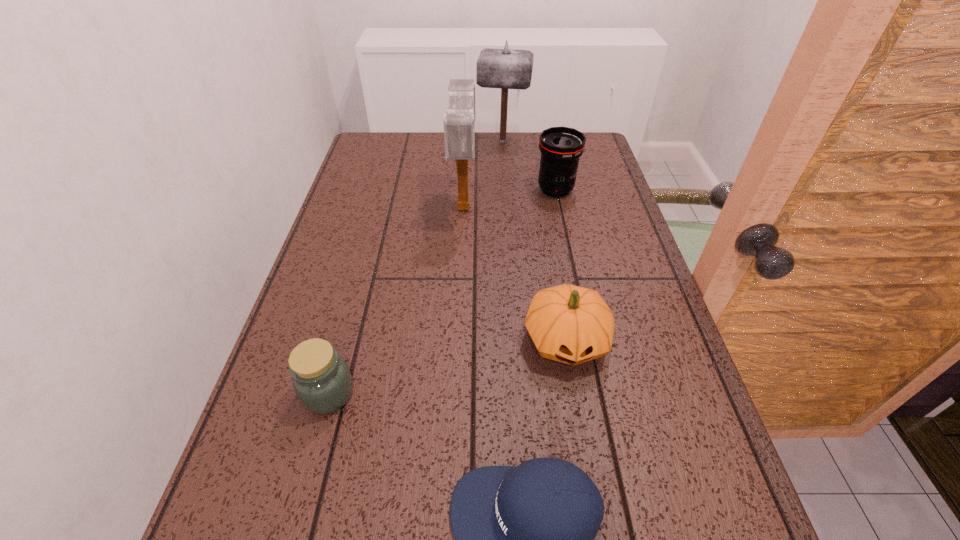
Locate an element on the screen. The image size is (960, 540). vacant space situated on the side of the third shortest object with the carved face is located at coordinates (587, 464).

Where is `vacant region located on the back of the leftmost object`? The width and height of the screenshot is (960, 540). vacant region located on the back of the leftmost object is located at coordinates (354, 298).

The height and width of the screenshot is (540, 960). I want to click on object that is at the far edge, so click(506, 68).

Identify the location of object that is positioned at the left edge. (322, 381).

The image size is (960, 540). What are the coordinates of `telephoto lens that is at the right edge` in the screenshot? It's located at click(x=561, y=147).

The height and width of the screenshot is (540, 960). In order to click on gourd that is at the right edge in this screenshot , I will do `click(570, 324)`.

Identify the location of vacant space at the far edge of the desktop. This screenshot has width=960, height=540. (416, 146).

Image resolution: width=960 pixels, height=540 pixels. I want to click on vacant space at the left edge, so click(372, 298).

The height and width of the screenshot is (540, 960). In order to click on free space at the right edge of the desktop in this screenshot , I will do tap(614, 238).

Locate an element on the screen. The image size is (960, 540). vacant region between the nearer mallet and the telephoto lens is located at coordinates (510, 198).